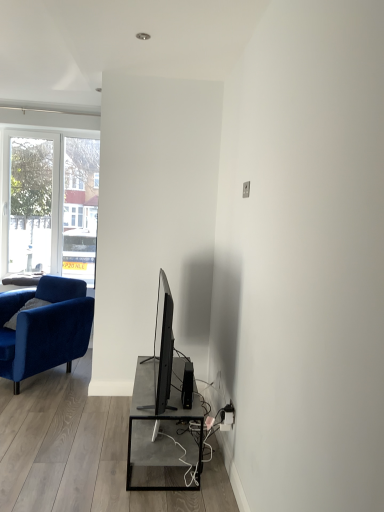
Where is `velvet blue armchair at left`? velvet blue armchair at left is located at coordinates (45, 328).

This screenshot has width=384, height=512. Describe the element at coordinates (45, 328) in the screenshot. I see `velvet blue armchair at left` at that location.

Where is `black plastic speaker at lower center`? The height and width of the screenshot is (512, 384). black plastic speaker at lower center is located at coordinates (187, 385).

Describe the element at coordinates (187, 385) in the screenshot. I see `black plastic speaker at lower center` at that location.

What is the approximate height of black plastic speaker at lower center?

black plastic speaker at lower center is 8.69 inches tall.

The image size is (384, 512). I want to click on velvet blue armchair at left, so click(x=45, y=328).

Is velvet blue armchair at left to the right of black plastic speaker at lower center from the viewer's perspective?

In fact, velvet blue armchair at left is to the left of black plastic speaker at lower center.

Between velvet blue armchair at left and black plastic speaker at lower center, which one is positioned in front?

black plastic speaker at lower center is in front.

Between point (10, 362) and point (189, 400), which one is positioned in front?

The point (189, 400) is in front.

From the image's perspective, is velvet blue armchair at left on black plastic speaker at lower center?

Yes, from the image's perspective, velvet blue armchair at left is on top of black plastic speaker at lower center.

From a real-world perspective, is velvet blue armchair at left below black plastic speaker at lower center?

Yes, from a real-world perspective, velvet blue armchair at left is beneath black plastic speaker at lower center.

Can you confirm if velvet blue armchair at left is wider than black plastic speaker at lower center?

Yes, velvet blue armchair at left is wider than black plastic speaker at lower center.

Between velvet blue armchair at left and black plastic speaker at lower center, which one has less height?

With less height is black plastic speaker at lower center.

Based on their sizes in the image, would you say velvet blue armchair at left is bigger or smaller than black plastic speaker at lower center?

velvet blue armchair at left is bigger than black plastic speaker at lower center.

Is black plastic speaker at lower center located within velvet blue armchair at left?

Definitely not — black plastic speaker at lower center is not inside velvet blue armchair at left.

Is velvet blue armchair at left touching black plastic speaker at lower center?

No.

Is velvet blue armchair at left oriented away from black plastic speaker at lower center?

No.

How much distance is there between velvet blue armchair at left and black plastic speaker at lower center?

velvet blue armchair at left is 1.55 meters away from black plastic speaker at lower center.

At what (x,y) coordinates should I click in order to perform the action: click on chair behind the black plastic speaker at lower center. Please return your answer as a coordinate pair (x, y). This screenshot has width=384, height=512. Looking at the image, I should click on (45, 328).

Which is more to the left, black plastic speaker at lower center or velvet blue armchair at left?

velvet blue armchair at left.

Which object is closer to the camera taking this photo, black plastic speaker at lower center or velvet blue armchair at left?

black plastic speaker at lower center is closer to the camera.

Between point (184, 366) and point (58, 333), which one is positioned behind?

Point (58, 333)

From the image's perspective, which one is positioned lower, black plastic speaker at lower center or velvet blue armchair at left?

black plastic speaker at lower center.

Consider the image. From a real-world perspective, which object stands above the other?

black plastic speaker at lower center.

In terms of width, does black plastic speaker at lower center look wider or thinner when compared to velvet blue armchair at left?

Clearly, black plastic speaker at lower center has less width compared to velvet blue armchair at left.

Between black plastic speaker at lower center and velvet blue armchair at left, which one has less height?

With less height is black plastic speaker at lower center.

Can you confirm if black plastic speaker at lower center is smaller than velvet blue armchair at left?

Yes.

Looking at this image, does black plastic speaker at lower center contain velvet blue armchair at left?

No.

Consider the image. Is black plastic speaker at lower center placed right next to velvet blue armchair at left?

black plastic speaker at lower center and velvet blue armchair at left are not in contact.

Is black plastic speaker at lower center oriented away from velvet blue armchair at left?

No, velvet blue armchair at left is not at the back of black plastic speaker at lower center.

How different are the orientations of black plastic speaker at lower center and velvet blue armchair at left in degrees?

There is a 63-degree angle between the facing directions of black plastic speaker at lower center and velvet blue armchair at left.

Where is `speaker lying on the right of velvet blue armchair at left`? The image size is (384, 512). speaker lying on the right of velvet blue armchair at left is located at coordinates (187, 385).

The image size is (384, 512). I want to click on speaker on the right of velvet blue armchair at left, so click(187, 385).

Locate an element on the screen. The height and width of the screenshot is (512, 384). chair behind the black plastic speaker at lower center is located at coordinates (45, 328).